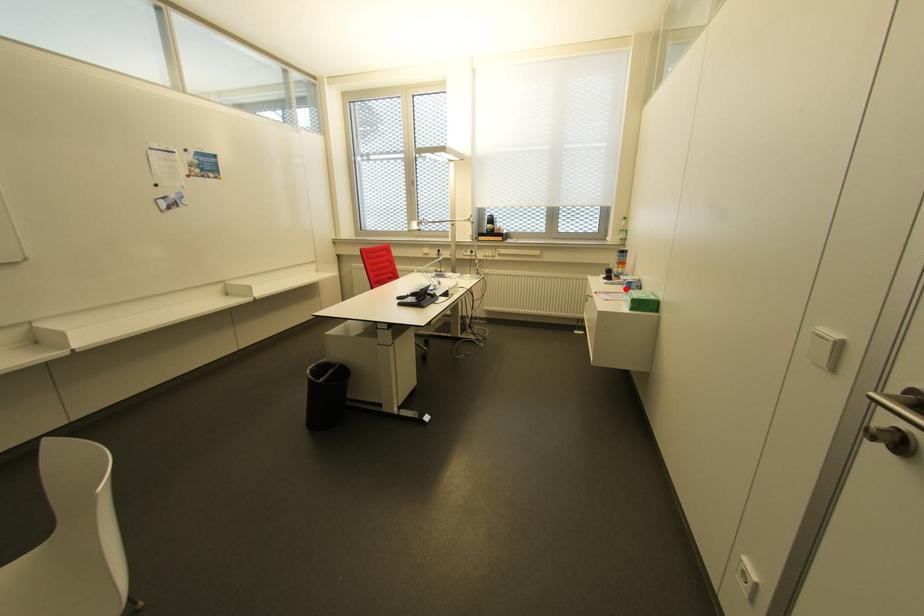
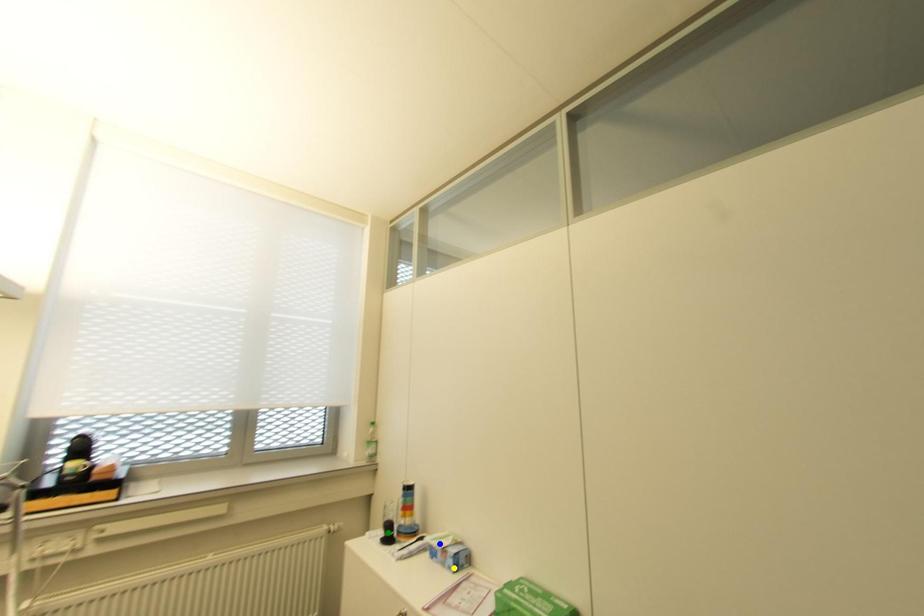
Question: I am providing you with two images of the same scene from different viewpoints. A red point is marked on the first image. You are given multiple points on the second image. In image 2, which mark is for the same physical point as the one in image 1?

Choices:
 (A) yellow point
 (B) blue point
 (C) green point

Answer: (A)